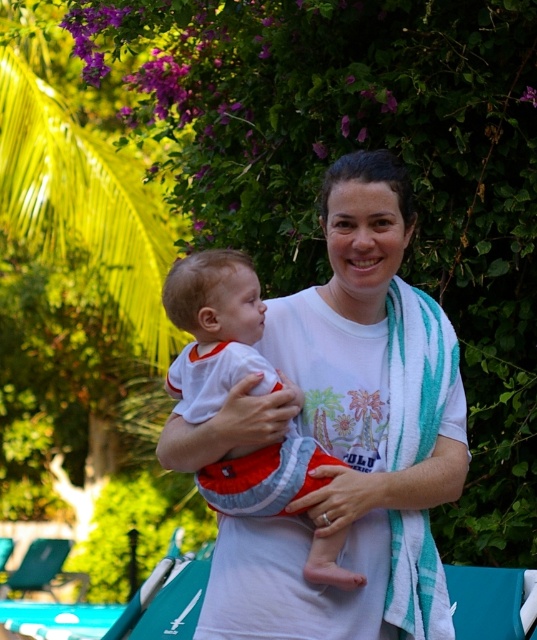
In the scene shown: Does white cotton shirt at center have a lesser width compared to white cotton baby at center?

No, white cotton shirt at center is not thinner than white cotton baby at center.

Who is higher up, white cotton shirt at center or white cotton baby at center?

white cotton shirt at center is higher up.

Is point (434, 428) closer to camera compared to point (192, 308)?

That is False.

You are a GUI agent. You are given a task and a screenshot of the screen. Output one action in this format:
    pyautogui.click(x=<x>, y=<y>)
    Task: Click on the white cotton shirt at center
    This screenshot has width=537, height=640.
    Given the screenshot: What is the action you would take?
    pyautogui.click(x=355, y=435)